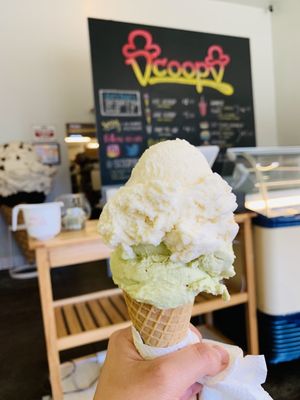
Where is `floor`? The image size is (300, 400). floor is located at coordinates (34, 345).